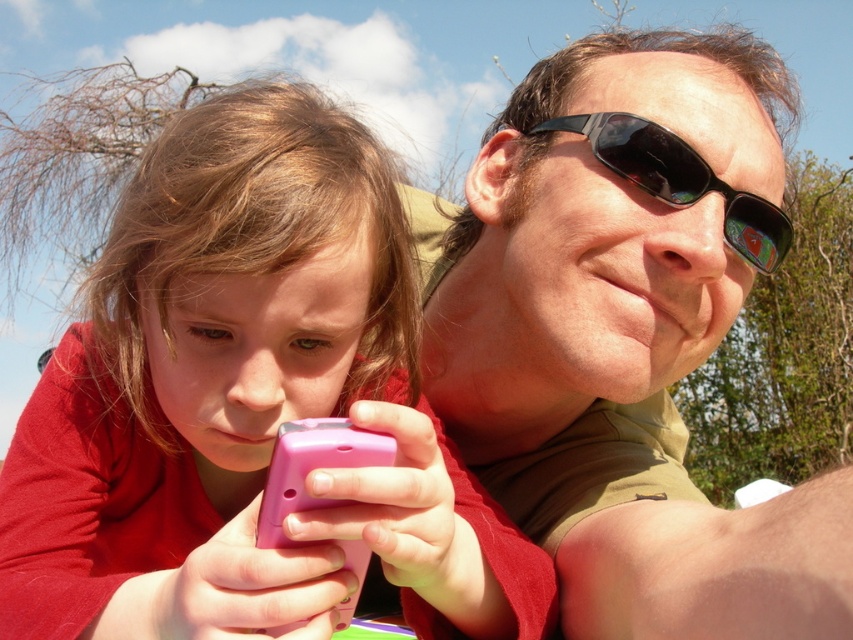
Who is shorter, matte black sunglasses at upper center or black plastic sunglasses at upper center?

black plastic sunglasses at upper center is shorter.

Between point (631, 554) and point (730, 241), which one is positioned behind?

The point (730, 241) is more distant.

Where is `matte black sunglasses at upper center`? The height and width of the screenshot is (640, 853). matte black sunglasses at upper center is located at coordinates (630, 337).

Is point (212, 314) positioned after point (701, 182)?

No, it is not.

Is pink matte phone at center positioned at the back of black plastic sunglasses at upper center?

No, pink matte phone at center is closer to the viewer.

Between point (303, 548) and point (763, 252), which one is positioned in front?

Point (303, 548)

At what (x,y) coordinates should I click in order to perform the action: click on pink matte phone at center. Please return your answer as a coordinate pair (x, y). Looking at the image, I should click on (247, 403).

Does pink matte phone at center have a greater height compared to matte black sunglasses at upper center?

No, pink matte phone at center is not taller than matte black sunglasses at upper center.

Who is more forward, (368, 154) or (535, 298)?

Answer: Point (368, 154) is more forward.

I want to click on pink matte phone at center, so click(247, 403).